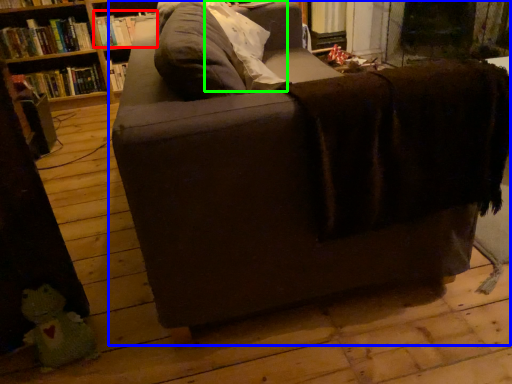
Question: Based on their relative distances, which object is nearer to book (highlighted by a red box)? Choose from studio couch (highlighted by a blue box) and pillow (highlighted by a green box).

Choices:
 (A) studio couch
 (B) pillow

Answer: (B)